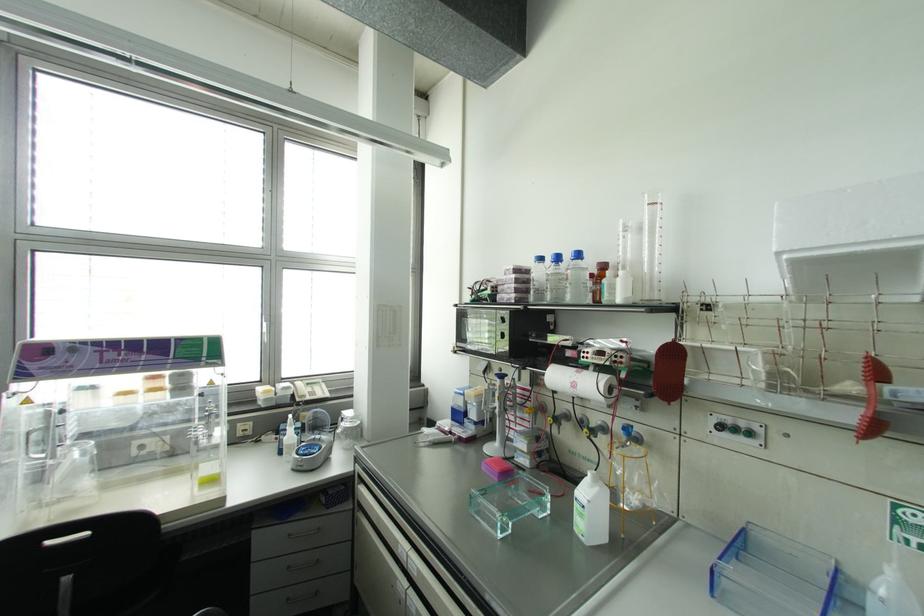
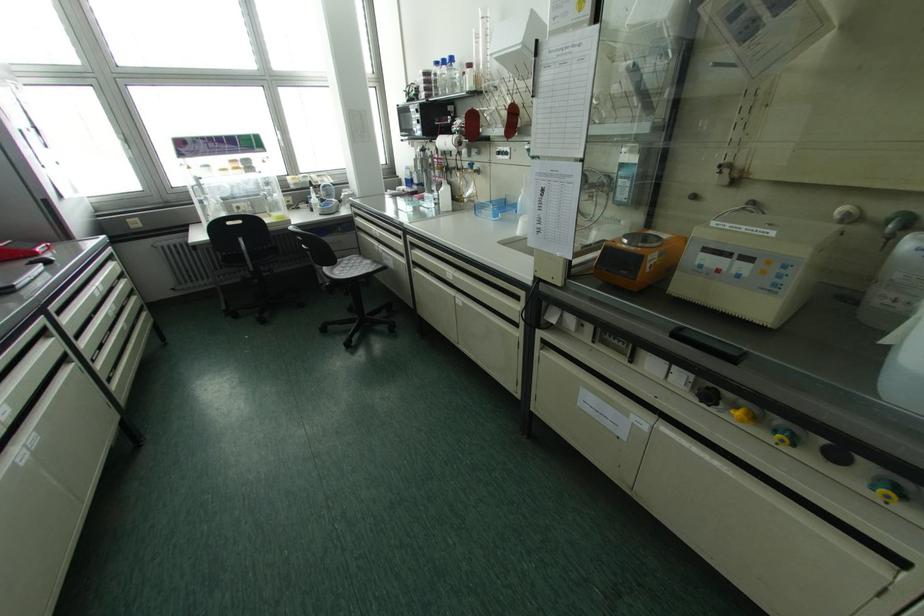
In the second image, find the point that corresponds to [540,257] in the first image.

(435, 63)